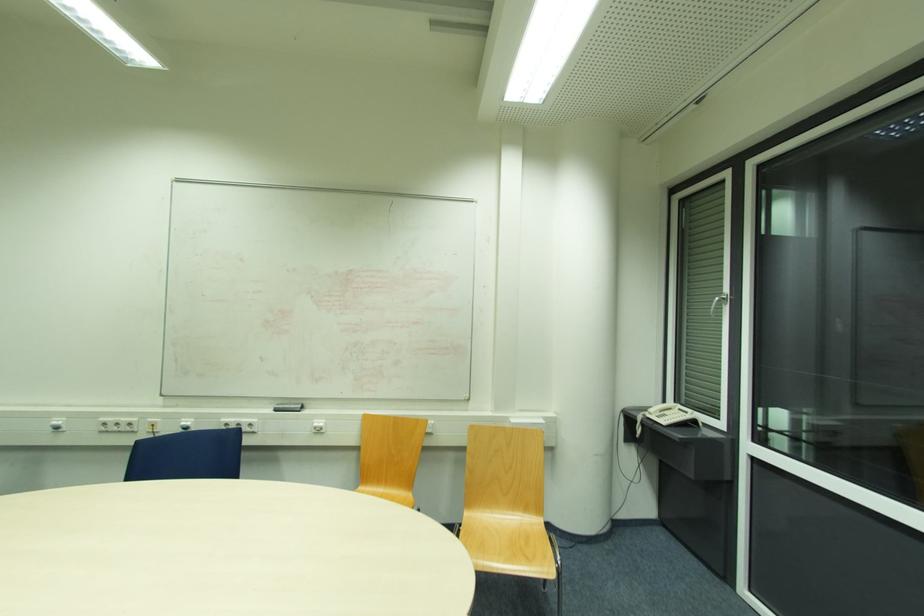
This screenshot has width=924, height=616. What do you see at coordinates (287, 407) in the screenshot?
I see `a black whiteboard eraser` at bounding box center [287, 407].